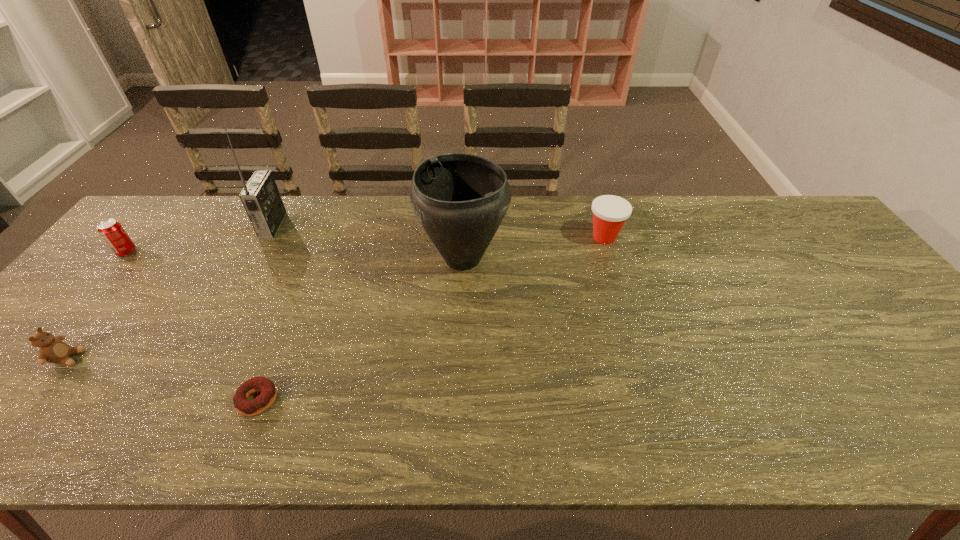
This screenshot has height=540, width=960. I want to click on radio receiver, so click(x=261, y=199).

The height and width of the screenshot is (540, 960). I want to click on the fifth object from left to right, so click(x=460, y=199).

This screenshot has height=540, width=960. What are the coordinates of `the rightmost object` in the screenshot? It's located at (610, 212).

The width and height of the screenshot is (960, 540). In order to click on the leftmost object in this screenshot , I will do `click(112, 232)`.

Where is `the fifth farthest object`? The height and width of the screenshot is (540, 960). the fifth farthest object is located at coordinates (52, 349).

At what (x,y) coordinates should I click in order to perform the action: click on the fifth object from right to left. Please return your answer as a coordinate pair (x, y). This screenshot has height=540, width=960. Looking at the image, I should click on (52, 349).

Where is `the shortest object`? The image size is (960, 540). the shortest object is located at coordinates (268, 389).

The width and height of the screenshot is (960, 540). In order to click on doughnut in this screenshot , I will do `click(268, 389)`.

Where is `free location located 0.360m on the display of the fourth object from right to left`? The image size is (960, 540). free location located 0.360m on the display of the fourth object from right to left is located at coordinates (396, 225).

Identify the location of vacant point located 0.130m on the left of the second object from right to left. (373, 258).